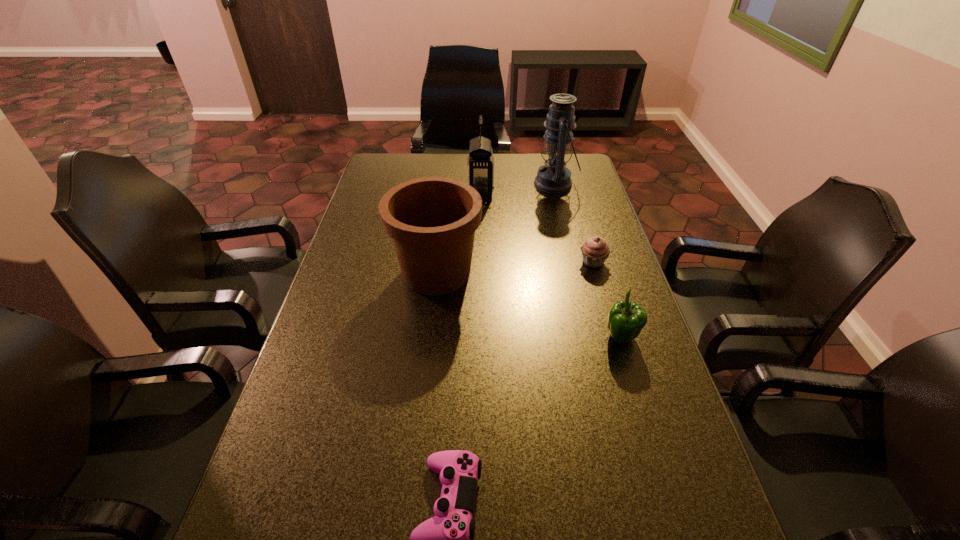
At what (x,y) coordinates should I click in order to perform the action: click on free spot between the taller lantern and the cupcake. Please return your answer as a coordinate pair (x, y). The width and height of the screenshot is (960, 540). Looking at the image, I should click on (574, 223).

Find the location of a particular element. The image size is (960, 540). blank region between the left lantern and the tallest object is located at coordinates (518, 188).

The image size is (960, 540). I want to click on object that stands as the third closest to the flowerpot, so click(626, 319).

Choose which object is the second nearest neighbor to the flowerpot. Please provide its 2D coordinates. Your answer should be formatted as a tuple, i.e. [(x, y)], where the tuple contains the x and y coordinates of a point satisfying the conditions above.

[(595, 250)]

At what (x,y) coordinates should I click in order to perform the action: click on free spot that satisfies the following two spatial constraints: 1. on the front-facing side of the fifth tallest object; 2. on the right side of the shorter lantern. Please return your answer as a coordinate pair (x, y). Looking at the image, I should click on (481, 262).

At what (x,y) coordinates should I click in order to perform the action: click on vacant space that satisfies the following two spatial constraints: 1. on the front-facing side of the second shortest object; 2. on the right side of the tallest object. Please return your answer as a coordinate pair (x, y). This screenshot has height=540, width=960. Looking at the image, I should click on (574, 262).

I want to click on vacant area in the image that satisfies the following two spatial constraints: 1. on the front-facing side of the shorter lantern; 2. on the left side of the fifth tallest object, so click(x=481, y=262).